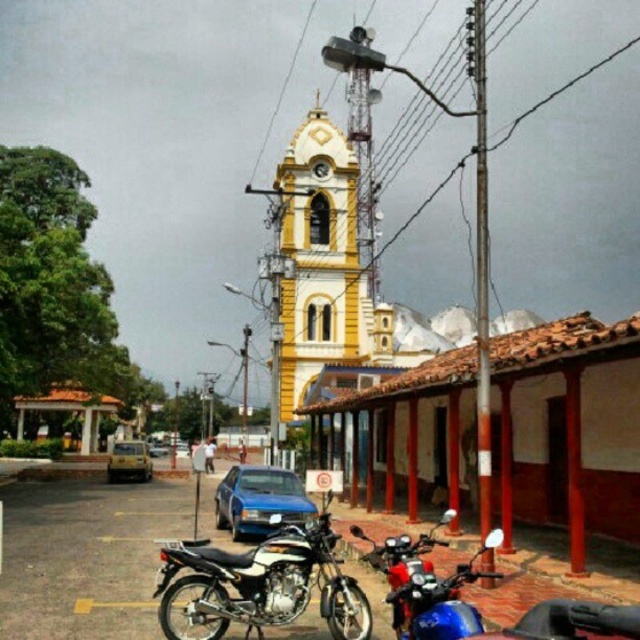
You are standing in the town square and want to take a photo of the yellow painted stone clock tower at center. If the recommended minimum distance for clear photos is 400 feet, is the current distance sufficient?

The yellow painted stone clock tower at center is 395.91 feet away from the camera, which is slightly less than the recommended 400 feet. Therefore, the current distance is sufficient for a clear photo.

You are a tourist visiting the town and want to take a photo of the yellow painted stone clock tower at center and the shiny black motorcycle at center. Since you want both to be in the frame, will the motorcycle be smaller in the photo compared to the tower?

The yellow painted stone clock tower at center has a larger size compared to the shiny black motorcycle at center, so yes, the motorcycle will appear smaller in the photo compared to the tower.

You are standing on the street and want to take a photo of the shiny chrome motorcycle at center without the yellow painted stone clock tower at center blocking the view. Is this possible?

The yellow painted stone clock tower at center is positioned over the shiny chrome motorcycle at center, so it would block the view of the motorcycle. You cannot take a photo of the motorcycle without the tower blocking it.